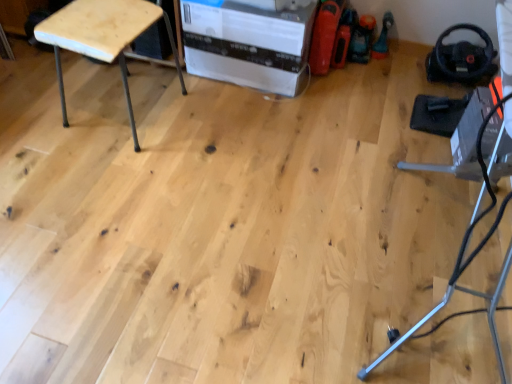
Identify the location of free space in front of natural wood stool at upper left. The height and width of the screenshot is (384, 512). (105, 168).